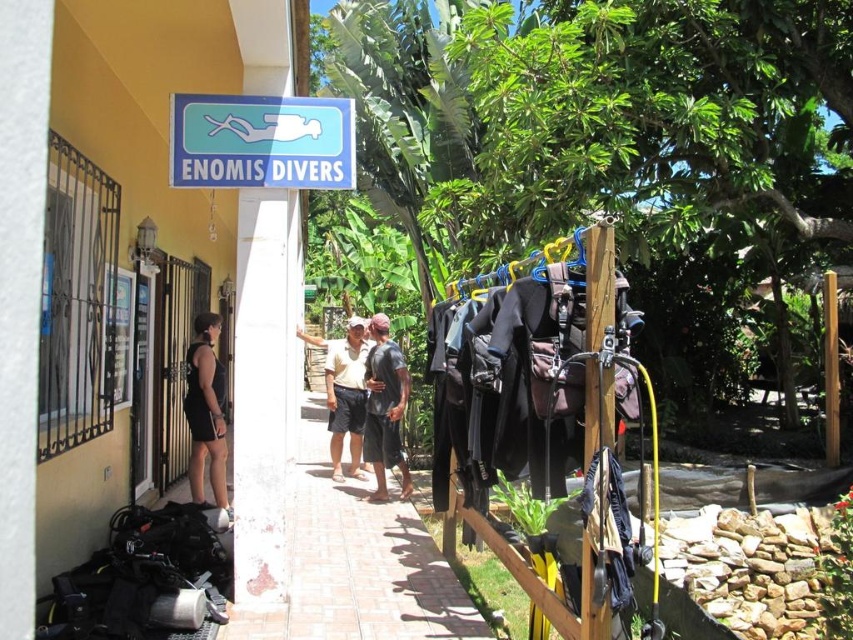
Does brick pavement at center have a greater width compared to black cotton shorts at center?

Correct, the width of brick pavement at center exceeds that of black cotton shorts at center.

Can you confirm if brick pavement at center is smaller than black cotton shorts at center?

Actually, brick pavement at center might be larger than black cotton shorts at center.

Is point (294, 490) farther from camera compared to point (399, 371)?

Yes, point (294, 490) is farther from viewer.

Identify the location of brick pavement at center. This screenshot has width=853, height=640. (352, 563).

Does blue plastic sign at upper center have a smaller size compared to light brown cotton shorts at center?

Actually, blue plastic sign at upper center might be larger than light brown cotton shorts at center.

Does blue plastic sign at upper center have a lesser width compared to light brown cotton shorts at center?

No, blue plastic sign at upper center is not thinner than light brown cotton shorts at center.

The image size is (853, 640). Describe the element at coordinates (260, 141) in the screenshot. I see `blue plastic sign at upper center` at that location.

Locate an element on the screen. The width and height of the screenshot is (853, 640). blue plastic sign at upper center is located at coordinates point(260,141).

Who is more distant from viewer, (312, 516) or (358, 440)?

The point (358, 440) is behind.

In the scene shown: Between brick pavement at center and light brown cotton shorts at center, which one is positioned lower?

Positioned lower is light brown cotton shorts at center.

Does point (345, 481) come closer to viewer compared to point (352, 346)?

No, (345, 481) is behind (352, 346).

Identify the location of brick pavement at center. (352, 563).